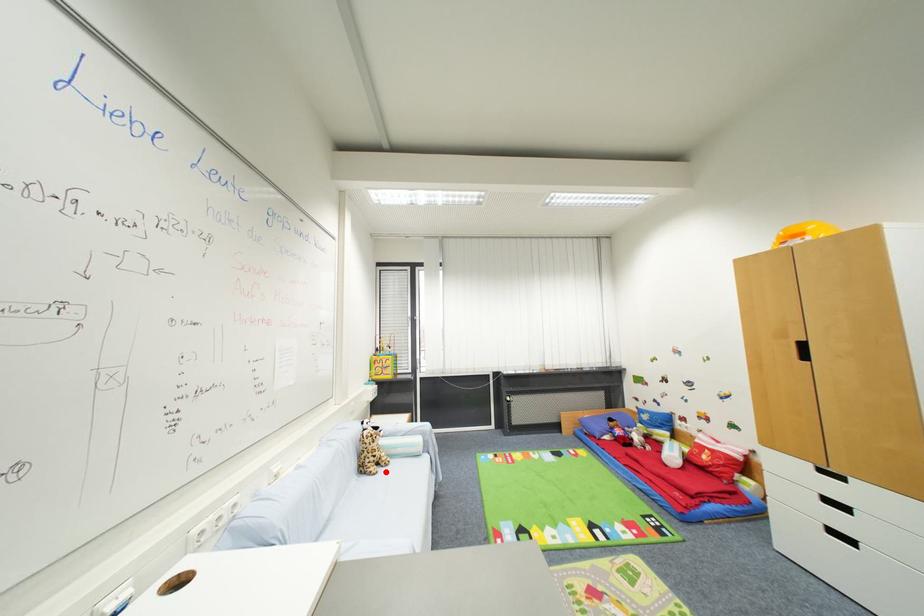
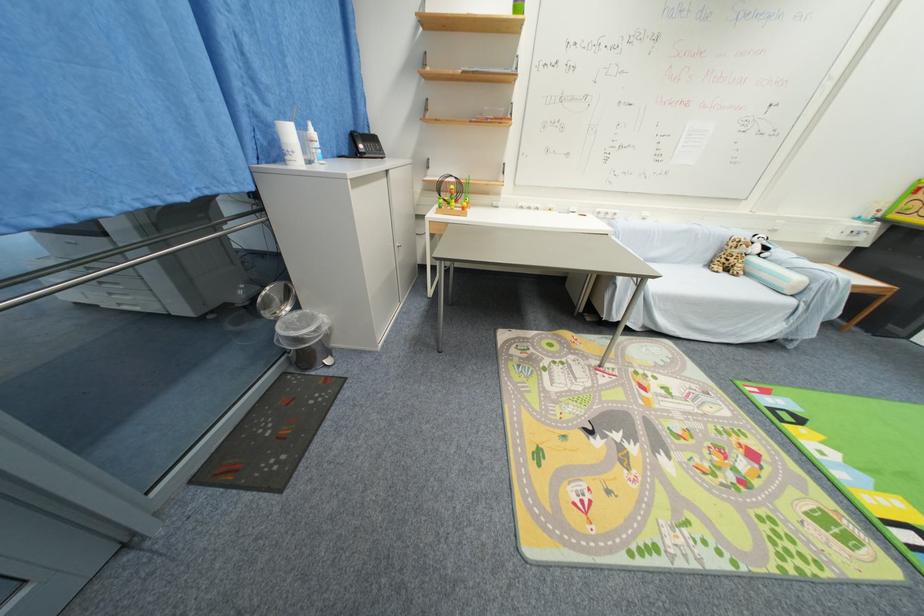
Where in the second image is the point corresponding to the highlighted location from the first image?

(730, 276)